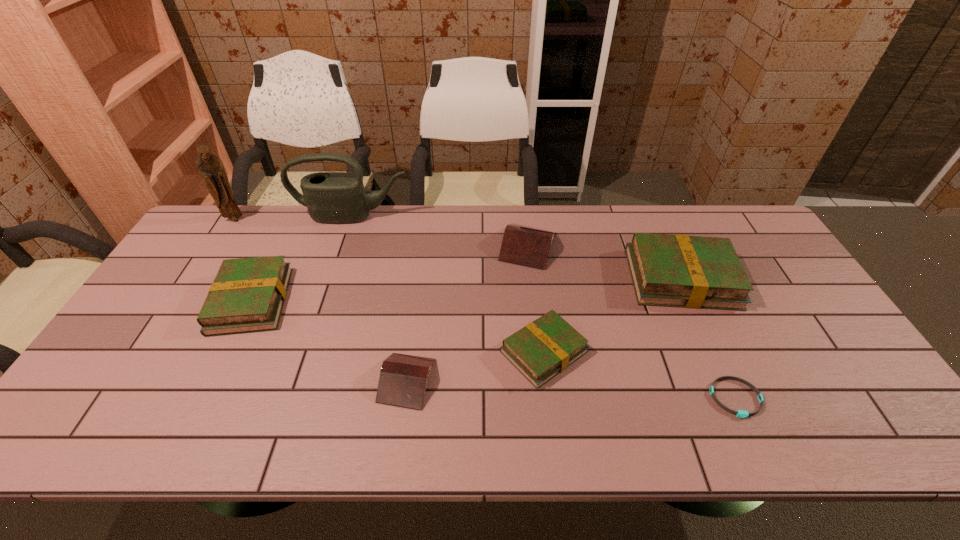
You are a GUI agent. You are given a task and a screenshot of the screen. Output one action in this format:
    pyautogui.click(x=<x>, y=<y>)
    Task: Click on the free area in between the smaller brown book and the shortest object
    This screenshot has width=960, height=540.
    Given the screenshot: What is the action you would take?
    pyautogui.click(x=571, y=389)

Choose which object is the fifth nearest neighbor to the rightmost book. Please provide its 2D coordinates. Your answer should be formatted as a tuple, i.e. [(x, y)], where the tuple contains the x and y coordinates of a point satisfying the conditions above.

[(331, 197)]

Locate which object ranks second in proximity to the green watering can. Please provide its 2D coordinates. Your answer should be formatted as a tuple, i.e. [(x, y)], where the tuple contains the x and y coordinates of a point satisfying the conditions above.

[(248, 294)]

Select which book is the third closest to the farther brown book. Please provide its 2D coordinates. Your answer should be formatted as a tuple, i.e. [(x, y)], where the tuple contains the x and y coordinates of a point satisfying the conditions above.

[(403, 378)]

Identify which book is located as the fifth nearest to the green watering can. Please provide its 2D coordinates. Your answer should be formatted as a tuple, i.e. [(x, y)], where the tuple contains the x and y coordinates of a point satisfying the conditions above.

[(686, 271)]

Find the location of `yellow book that is the second closest to the leftmost book`. yellow book that is the second closest to the leftmost book is located at coordinates (686, 271).

Point out which yellow book is positioned as the third nearest to the nearer brown book. Please provide its 2D coordinates. Your answer should be formatted as a tuple, i.e. [(x, y)], where the tuple contains the x and y coordinates of a point satisfying the conditions above.

[(686, 271)]

Where is `vacant space that satisfies the following two spatial constraints: 1. on the spout of the green watering can; 2. on the right side of the right brown book`? The height and width of the screenshot is (540, 960). vacant space that satisfies the following two spatial constraints: 1. on the spout of the green watering can; 2. on the right side of the right brown book is located at coordinates (343, 246).

Identify the location of free location that satisfies the following two spatial constraints: 1. on the back side of the bigger brown book; 2. on the left side of the leftmost yellow book. (278, 246).

The width and height of the screenshot is (960, 540). Find the location of `free space that satisfies the following two spatial constraints: 1. on the front side of the smallest yellow book; 2. on the left side of the right brown book`. free space that satisfies the following two spatial constraints: 1. on the front side of the smallest yellow book; 2. on the left side of the right brown book is located at coordinates (540, 352).